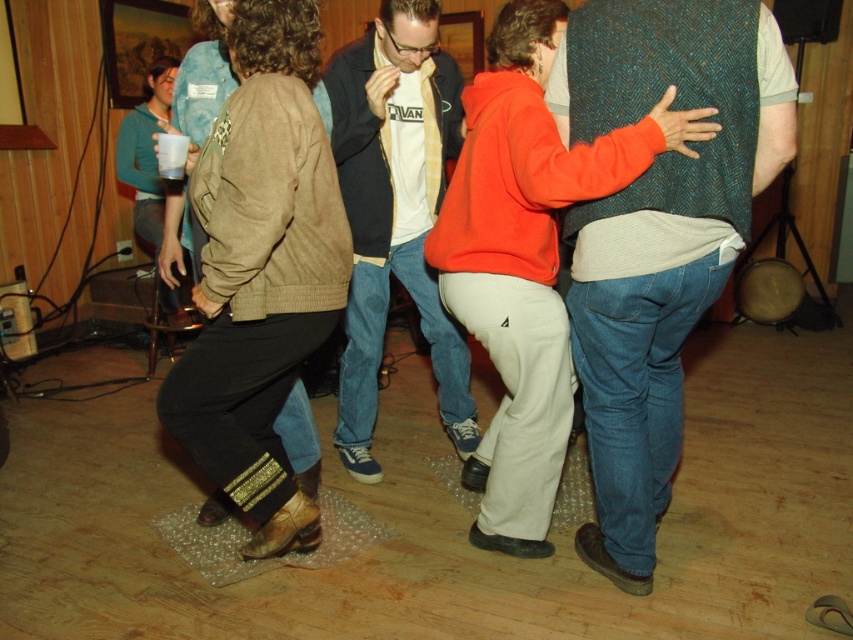
You are a photographer trying to capture the perfect shot of the orange fleece jacket at center and the matte white shirt at center. Since you want to highlight the size difference between them, which object should you focus on to emphasize their widths?

The orange fleece jacket at center is wider than the matte white shirt at center, so focusing on the orange fleece jacket at center will emphasize their width difference.

You are standing in the center of the room and want to hand a gift to the person wearing the green tweed vest at center. Based on their position, in which direction should you move to reach them?

The green tweed vest at center is located at point (656, 237), so you should move towards the center of the room to reach them.

You are a photographer trying to capture a candid shot of the two dancers wearing the green tweed vest at center and orange fleece jacket at center. Since you want to ensure both are fully visible in the frame, which one should you position closer to the camera to avoid cropping?

The green tweed vest at center is shorter than the orange fleece jacket at center. To ensure both are fully visible, position the green tweed vest at center closer to the camera so its shorter height can be accommodated within the frame without being cut off.